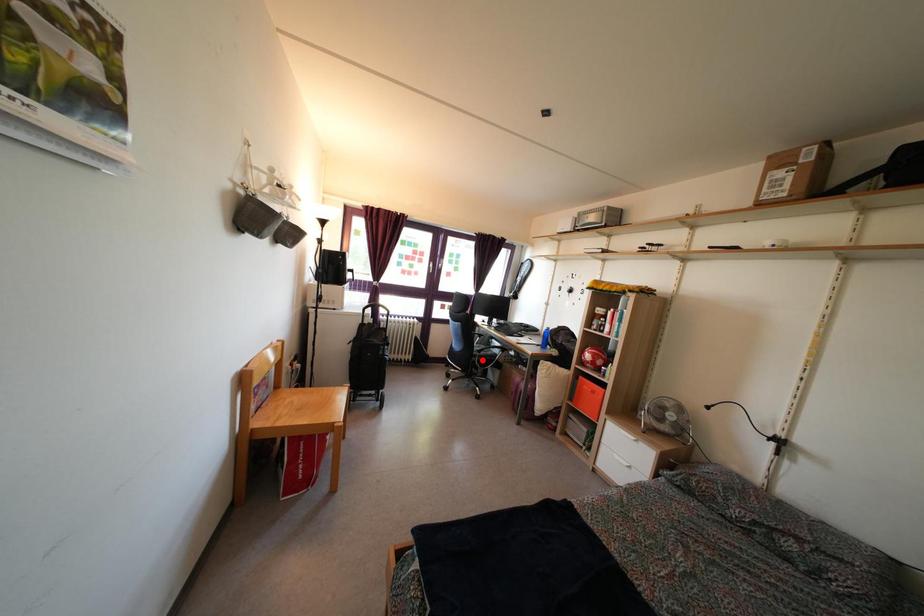
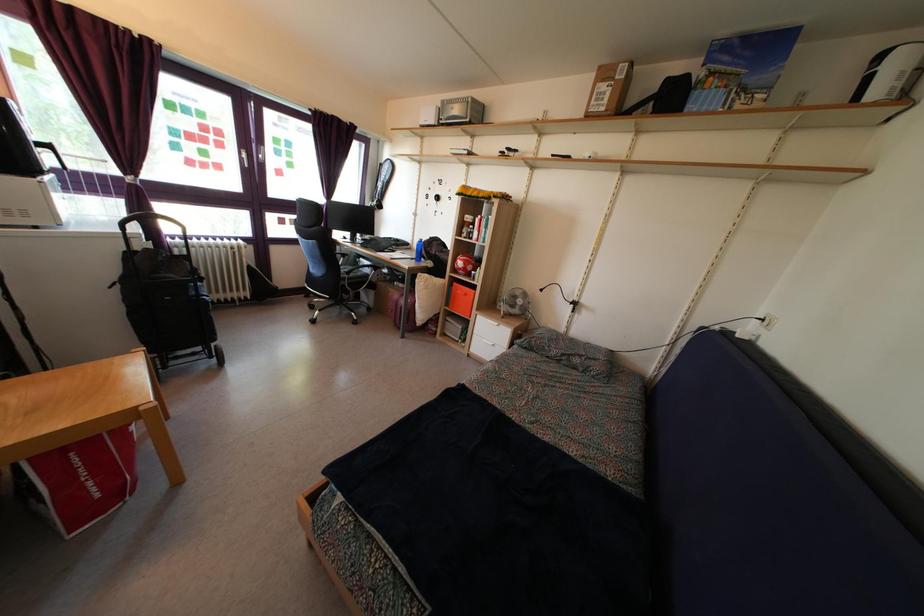
Question: I am providing you with two images of the same scene from different viewpoints. Image1 has a red point marked. In image2, the corresponding 3D location appears at what relative position? Reply with the corresponding letter.

Choices:
 (A) Closer
 (B) Farther

Answer: (A)